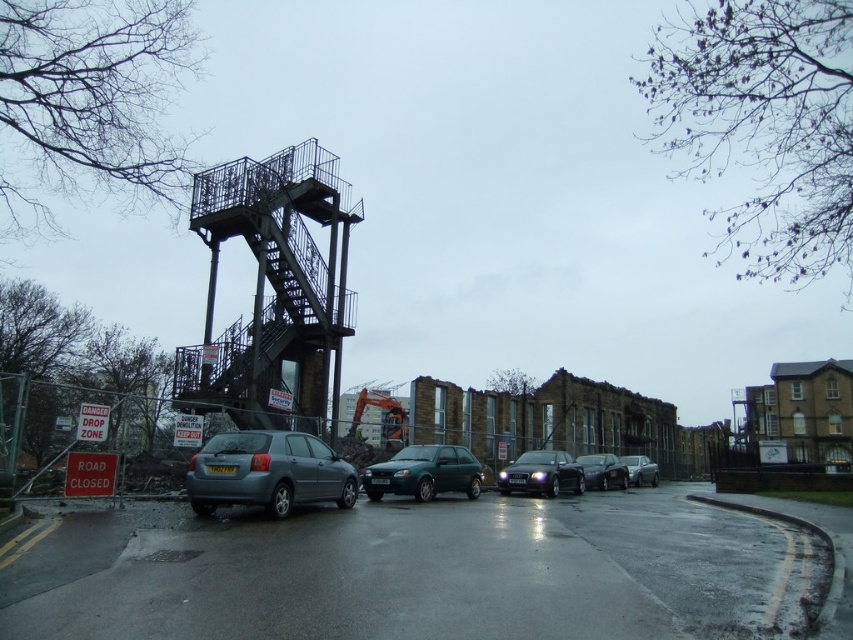
Is point (585, 484) less distant than point (633, 468)?

Yes, it is.

Is shiny black sedan at center behind metallic silver car at center?

No.

Locate an element on the screen. shiny black sedan at center is located at coordinates (602, 472).

Locate an element on the screen. The height and width of the screenshot is (640, 853). shiny black sedan at center is located at coordinates (602, 472).

Who is more forward, (566, 481) or (587, 465)?

Point (566, 481) is in front.

Does shiny silver sedan at center lie behind shiny black sedan at center?

That is False.

Image resolution: width=853 pixels, height=640 pixels. What are the coordinates of `shiny silver sedan at center` in the screenshot? It's located at (541, 474).

Is matte gray hatchback at center below green matte hatchback at center?

No.

Does matte gray hatchback at center have a lesser height compared to green matte hatchback at center?

Incorrect, matte gray hatchback at center's height does not fall short of green matte hatchback at center's.

The image size is (853, 640). Identify the location of matte gray hatchback at center. (267, 472).

Identify the location of matte gray hatchback at center. The image size is (853, 640). (267, 472).